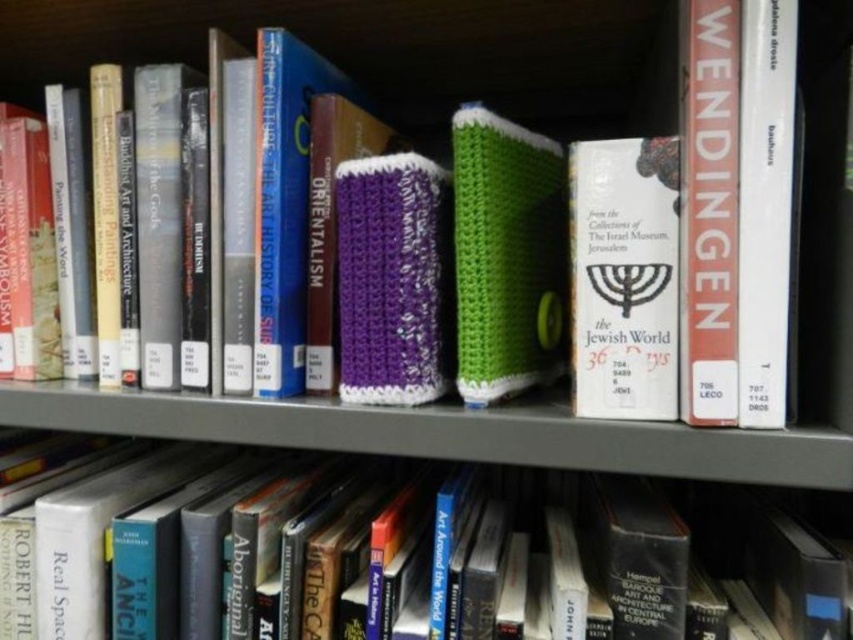
Question: Considering the real-world distances, which object is closest to the white paper book at center?

Choices:
 (A) hardcover book at center
 (B) green knitted book at center

Answer: (B)

Question: Among these objects, which one is farthest from the camera?

Choices:
 (A) hardcover book at center
 (B) green knitted book at center
 (C) white paper book at center

Answer: (B)

Question: Can you confirm if hardcover book at center is thinner than white paper book at center?

Choices:
 (A) yes
 (B) no

Answer: (B)

Question: In this image, where is hardcover book at center located relative to green knitted book at center?

Choices:
 (A) above
 (B) below

Answer: (B)

Question: From the image, what is the correct spatial relationship of hardcover book at center in relation to green knitted book at center?

Choices:
 (A) above
 (B) below

Answer: (B)

Question: Which object appears farthest from the camera in this image?

Choices:
 (A) green knitted book at center
 (B) white paper book at center
 (C) hardcover book at center

Answer: (A)